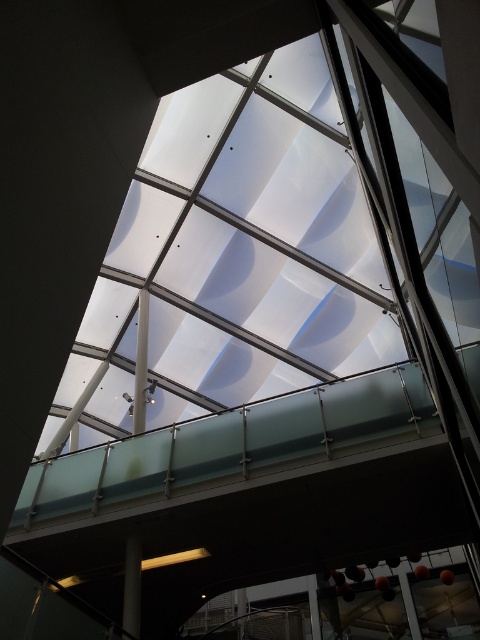
This screenshot has width=480, height=640. In order to click on white glossy pillar at center in this screenshot , I will do `click(141, 364)`.

Does white glossy pillar at center appear on the left side of smooth gray pillar at lower left?

Indeed, white glossy pillar at center is positioned on the left side of smooth gray pillar at lower left.

Measure the distance between point (141, 292) and camera.

They are 12.05 meters apart.

Find the location of a particular element. Image resolution: width=480 pixels, height=640 pixels. white glossy pillar at center is located at coordinates click(141, 364).